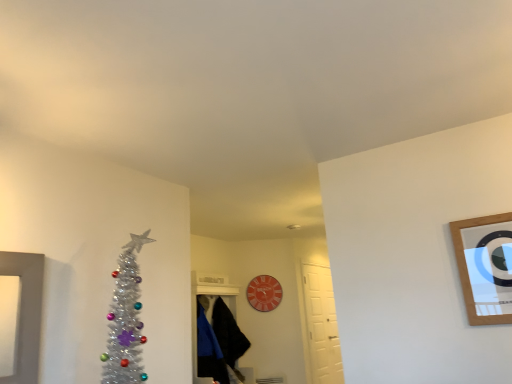
Describe the element at coordinates (322, 325) in the screenshot. I see `white matte door at center-right` at that location.

What do you see at coordinates (228, 333) in the screenshot? This screenshot has width=512, height=384. I see `black fuzzy robe at center, the second robe in the front-to-back sequence` at bounding box center [228, 333].

You are a GUI agent. You are given a task and a screenshot of the screen. Output one action in this format:
    pyautogui.click(x=<x>, y=<y>)
    Task: Click on the white matte door at center-right
    
    Given the screenshot: What is the action you would take?
    pos(322,325)

Is white matte door at center-right completely or partially inside wooden-framed mirror at upper right?

No, wooden-framed mirror at upper right does not contain white matte door at center-right.

Who is taller, wooden-framed mirror at upper right or white matte door at center-right?

With more height is white matte door at center-right.

Who is bigger, wooden-framed mirror at upper right or white matte door at center-right?

white matte door at center-right is bigger.

From a real-world perspective, which is physically above, wooden-framed mirror at upper right or white matte door at center-right?

wooden-framed mirror at upper right is physically above.

Is point (207, 330) more distant than point (496, 316)?

Yes, it is.

Is black matte robe at center, which ranks as the 2th robe in back-to-front order, wider or thinner than wooden-framed mirror at upper right?

black matte robe at center, which ranks as the 2th robe in back-to-front order, is wider than wooden-framed mirror at upper right.

From a real-world perspective, is black matte robe at center, which is counted as the first robe, starting from the front, on top of wooden-framed mirror at upper right?

No, from a real-world perspective, black matte robe at center, which is counted as the first robe, starting from the front, is not over wooden-framed mirror at upper right

Which object is positioned more to the right, black matte robe at center, which is counted as the first robe, starting from the front, or wooden-framed mirror at upper right?

wooden-framed mirror at upper right.

The image size is (512, 384). What are the coordinates of `picture frame above the black fuzzy robe at center, the second robe in the front-to-back sequence (from the image's perspective)` in the screenshot? It's located at pos(485,267).

Can you tell me how much wooden-framed mirror at upper right and black fuzzy robe at center, the first robe when ordered from back to front, differ in facing direction?

There is a 90.5-degree angle between the facing directions of wooden-framed mirror at upper right and black fuzzy robe at center, the first robe when ordered from back to front.

Is wooden-framed mirror at upper right directly adjacent to black fuzzy robe at center, the second robe in the front-to-back sequence?

wooden-framed mirror at upper right is not next to black fuzzy robe at center, the second robe in the front-to-back sequence, and they're not touching.

Is wooden-framed mirror at upper right positioned before black fuzzy robe at center, the first robe when ordered from back to front?

Yes, wooden-framed mirror at upper right is closer to the viewer.

At what (x,y) coordinates should I click in order to perform the action: click on picture frame lying above the white matte door at center-right (from the image's perspective). Please return your answer as a coordinate pair (x, y). The width and height of the screenshot is (512, 384). Looking at the image, I should click on (485, 267).

From the image's perspective, is white matte door at center-right under wooden-framed mirror at upper right?

Indeed, from the image's perspective, white matte door at center-right is shown beneath wooden-framed mirror at upper right.

From a real-world perspective, is white matte door at center-right under wooden-framed mirror at upper right?

Indeed, from a real-world perspective, white matte door at center-right is positioned beneath wooden-framed mirror at upper right.

Is there a large distance between white matte door at center-right and black matte robe at center, which is counted as the first robe, starting from the front?

Absolutely, white matte door at center-right is distant from black matte robe at center, which is counted as the first robe, starting from the front.

From a real-world perspective, does white matte door at center-right sit lower than black matte robe at center, which is counted as the first robe, starting from the front?

Yes.

Considering the sizes of objects white matte door at center-right and black matte robe at center, which is counted as the first robe, starting from the front, in the image provided, who is wider, white matte door at center-right or black matte robe at center, which is counted as the first robe, starting from the front,?

Wider between the two is black matte robe at center, which is counted as the first robe, starting from the front.

Considering the positions of points (227, 357) and (305, 279), is point (227, 357) farther from camera compared to point (305, 279)?

That is False.

From a real-world perspective, relative to white matte door at center-right, is black fuzzy robe at center, the second robe in the front-to-back sequence, vertically above or below?

Clearly, from a real-world perspective, black fuzzy robe at center, the second robe in the front-to-back sequence, is above white matte door at center-right.

Is black fuzzy robe at center, the first robe when ordered from back to front, placed right next to white matte door at center-right?

black fuzzy robe at center, the first robe when ordered from back to front, and white matte door at center-right are clearly separated.

Is black fuzzy robe at center, the second robe in the front-to-back sequence, oriented away from white matte door at center-right?

No, black fuzzy robe at center, the second robe in the front-to-back sequence,'s orientation is not away from white matte door at center-right.

From a real-world perspective, who is located lower, black matte robe at center, which ranks as the 2th robe in back-to-front order, or black fuzzy robe at center, the second robe in the front-to-back sequence?

black matte robe at center, which ranks as the 2th robe in back-to-front order, from a real-world perspective.

Is black fuzzy robe at center, the second robe in the front-to-back sequence, at the back of black matte robe at center, which ranks as the 2th robe in back-to-front order?

No, black fuzzy robe at center, the second robe in the front-to-back sequence, is not at the back of black matte robe at center, which ranks as the 2th robe in back-to-front order.

Could you measure the distance between black matte robe at center, which ranks as the 2th robe in back-to-front order, and black fuzzy robe at center, the first robe when ordered from back to front?

black matte robe at center, which ranks as the 2th robe in back-to-front order, is 6.90 inches away from black fuzzy robe at center, the first robe when ordered from back to front.

Between point (205, 323) and point (223, 351), which one is positioned in front?

The point (223, 351) is in front.

The height and width of the screenshot is (384, 512). What are the coordinates of `picture frame to the right of white matte door at center-right` in the screenshot? It's located at (485, 267).

From the image's perspective, starting from the wooden-framed mirror at upper right, which robe is the 1st one below? Please provide its 2D coordinates.

[(209, 349)]

When comparing their distances from white matte door at center-right, does wooden-framed mirror at upper right or black fuzzy robe at center, the second robe in the front-to-back sequence, seem further?

wooden-framed mirror at upper right is further to white matte door at center-right.

When comparing their distances from wooden-framed mirror at upper right, does black matte robe at center, which ranks as the 2th robe in back-to-front order, or white matte door at center-right seem closer?

white matte door at center-right is closer to wooden-framed mirror at upper right.

Which object lies further to the anchor point white matte door at center-right, wooden-framed mirror at upper right or black matte robe at center, which ranks as the 2th robe in back-to-front order?

Based on the image, wooden-framed mirror at upper right appears to be further to white matte door at center-right.

Looking at the image, which one is located closer to black fuzzy robe at center, the second robe in the front-to-back sequence, white matte door at center-right or wooden-framed mirror at upper right?

Based on the image, white matte door at center-right appears to be nearer to black fuzzy robe at center, the second robe in the front-to-back sequence.

Considering their positions, is white matte door at center-right positioned closer to black matte robe at center, which is counted as the first robe, starting from the front, than black fuzzy robe at center, the second robe in the front-to-back sequence?

black fuzzy robe at center, the second robe in the front-to-back sequence.

Estimate the real-world distances between objects in this image. Which object is further from black fuzzy robe at center, the first robe when ordered from back to front, black matte robe at center, which is counted as the first robe, starting from the front, or wooden-framed mirror at upper right?

wooden-framed mirror at upper right is further to black fuzzy robe at center, the first robe when ordered from back to front.

Looking at the image, which one is located further to black matte robe at center, which ranks as the 2th robe in back-to-front order, white matte door at center-right or wooden-framed mirror at upper right?

wooden-framed mirror at upper right lies further to black matte robe at center, which ranks as the 2th robe in back-to-front order, than the other object.

Based on the photo, based on their spatial positions, is white matte door at center-right or black fuzzy robe at center, the second robe in the front-to-back sequence, further from wooden-framed mirror at upper right?

black fuzzy robe at center, the second robe in the front-to-back sequence.

Find the location of a particular element. This screenshot has height=384, width=512. robe located between wooden-framed mirror at upper right and black fuzzy robe at center, the second robe in the front-to-back sequence, in the depth direction is located at coordinates (209, 349).

I want to click on robe between black matte robe at center, which is counted as the first robe, starting from the front, and white matte door at center-right, in the horizontal direction, so click(228, 333).